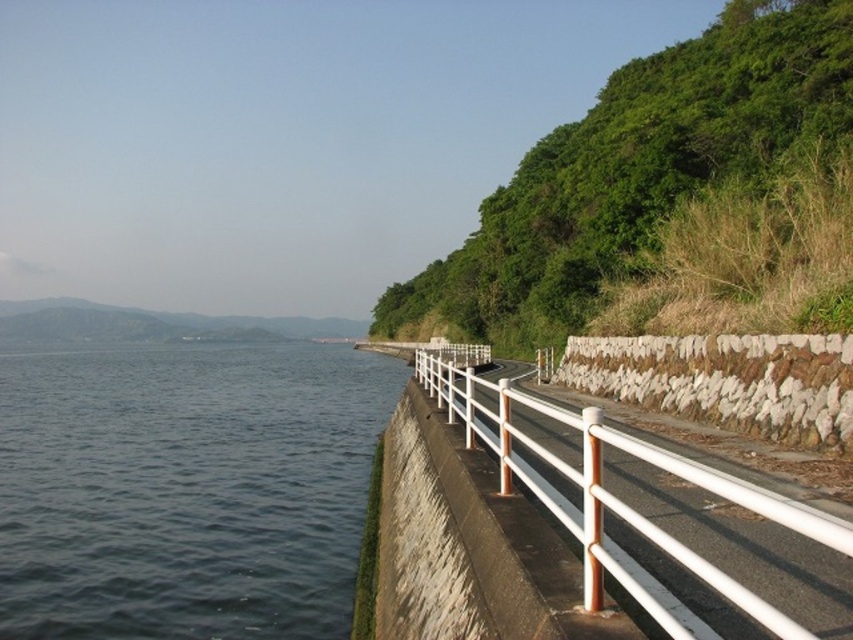
What do you see at coordinates (635, 172) in the screenshot? I see `green leafy hillside at upper right` at bounding box center [635, 172].

Between green leafy hillside at upper right and white glossy rail at right, which one is positioned higher?

green leafy hillside at upper right is above.

This screenshot has width=853, height=640. In order to click on green leafy hillside at upper right in this screenshot , I will do `click(635, 172)`.

Can you confirm if dark blue water at left is taller than white glossy rail at right?

Incorrect, dark blue water at left's height is not larger of white glossy rail at right's.

Is dark blue water at left wider than white glossy rail at right?

Indeed, dark blue water at left has a greater width compared to white glossy rail at right.

Does point (49, 461) come behind point (585, 548)?

Yes, point (49, 461) is farther from viewer.

Image resolution: width=853 pixels, height=640 pixels. I want to click on dark blue water at left, so click(186, 488).

Does dark blue water at left appear on the right side of green leafy hillside at upper right?

In fact, dark blue water at left is to the left of green leafy hillside at upper right.

Find the location of a particular element. The image size is (853, 640). dark blue water at left is located at coordinates (186, 488).

Is point (338, 474) less distant than point (836, 17)?

Yes, point (338, 474) is closer to viewer.

I want to click on dark blue water at left, so click(x=186, y=488).